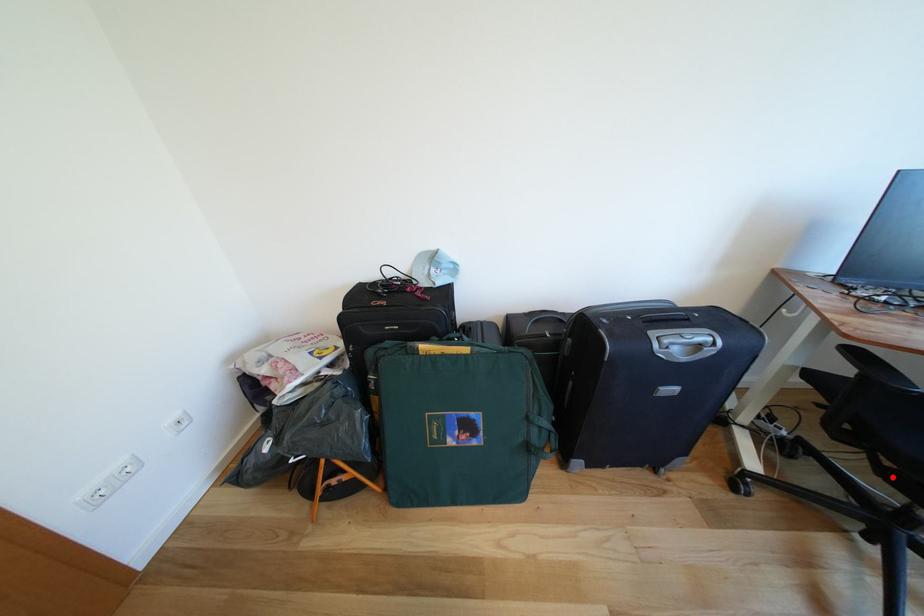
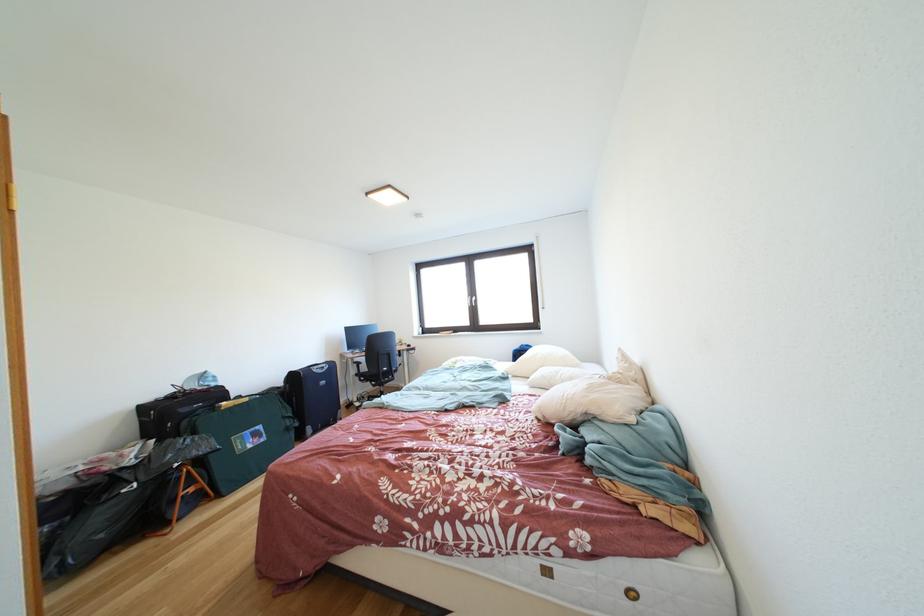
In the second image, find the point that corresponds to the highlighted location in the first image.

(383, 391)